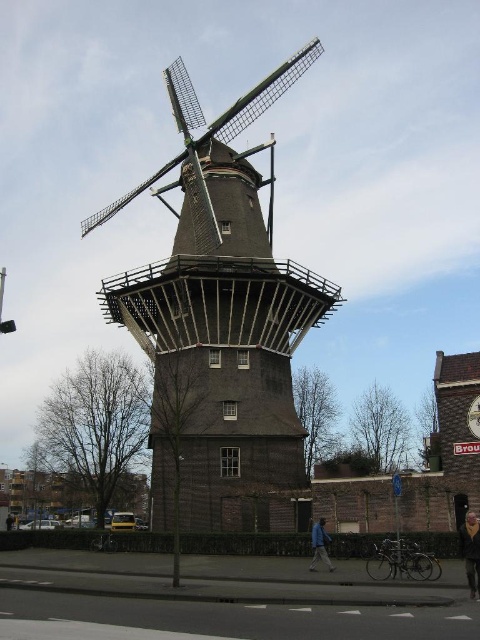
You are standing in front of the Dutch windmill and notice two jackets nearby. The dark brown leather jacket at lower right and the blue fabric jacket at lower center. Which jacket is positioned higher relative to the other?

The dark brown leather jacket at lower right is located above the blue fabric jacket at lower center, so it is positioned higher.

You are an artist planning to paint the scene of the Dutch windmill. You have a canvas that can only fit objects up to the size of the blue fabric jacket at lower center. Will the dark brown wooden windmill at center fit on your canvas?

The dark brown wooden windmill at center is bigger than the blue fabric jacket at lower center, so it will not fit on the canvas designed for the size of the blue fabric jacket at lower center.